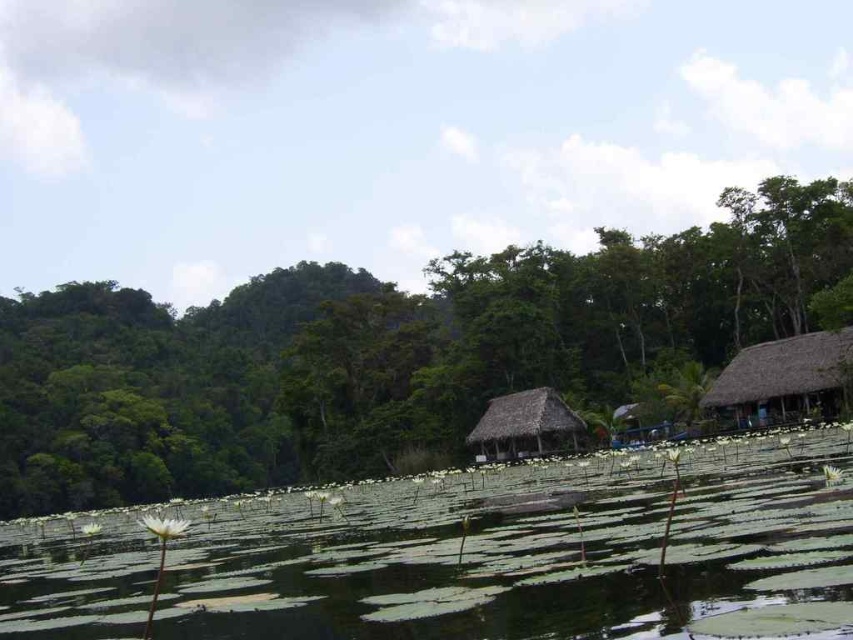
Question: Can you confirm if green leafy water at center is positioned to the right of thatched brown hut at right?

Choices:
 (A) yes
 (B) no

Answer: (B)

Question: Is green leafy tree at center above green leafy water at center?

Choices:
 (A) yes
 (B) no

Answer: (A)

Question: Which point is closer to the camera?

Choices:
 (A) thatched straw hut at center
 (B) thatched brown hut at right

Answer: (B)

Question: Which object is farther from the camera taking this photo?

Choices:
 (A) thatched straw hut at center
 (B) green leafy tree at center
 (C) thatched brown hut at right
 (D) green leafy water at center

Answer: (A)

Question: Which point is farther to the camera?

Choices:
 (A) thatched straw hut at center
 (B) green leafy tree at center

Answer: (A)

Question: Is green leafy tree at center positioned behind thatched straw hut at center?

Choices:
 (A) no
 (B) yes

Answer: (A)